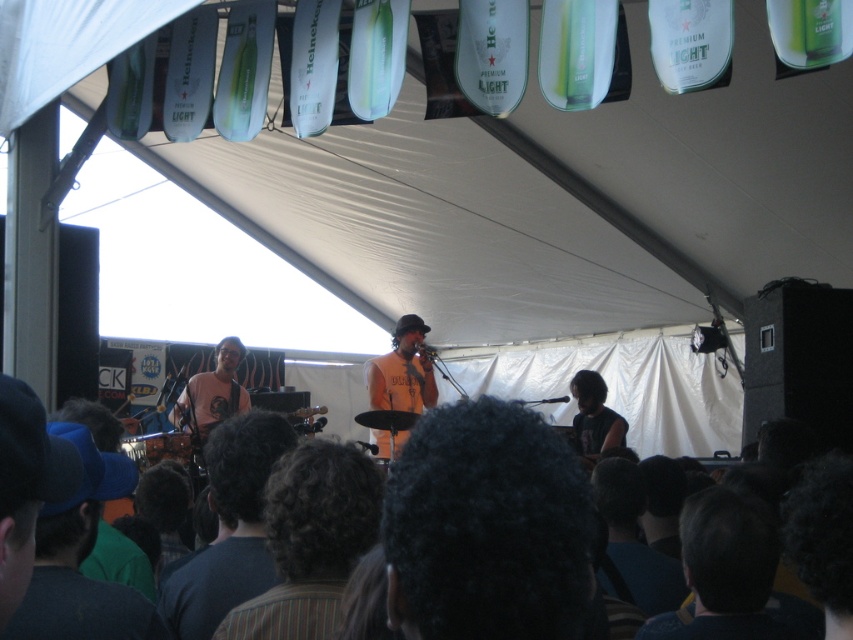
You are a photographer at the event and need to capture both the brown striped shirt at center and the orange cotton shirt at center in a single frame. Which shirt should you focus on to ensure both fit in the shot, considering their sizes?

The brown striped shirt at center has a lesser width compared to orange cotton shirt at center, so focusing on the orange cotton shirt at center would allow both to fit in the frame since it is wider and might require more space.

You are a photographer at the music event and want to capture both the blue fabric cap at lower left and the orange cotton shirt at center in your photo. Which object should you focus on first if you want to ensure both are in sharp focus?

The blue fabric cap at lower left is thinner than the orange cotton shirt at center, so focusing on the orange cotton shirt at center first would help ensure both are in sharp focus since it has a larger surface area for accurate focus.

You are attending the music event and want to take a photo of both the blue fabric cap at lower left and the orange cotton shirt at center. Which one should you focus on first to ensure both are in the frame?

You should focus on the blue fabric cap at lower left first since it is positioned to the left of the orange cotton shirt at center, ensuring both are captured in the frame.